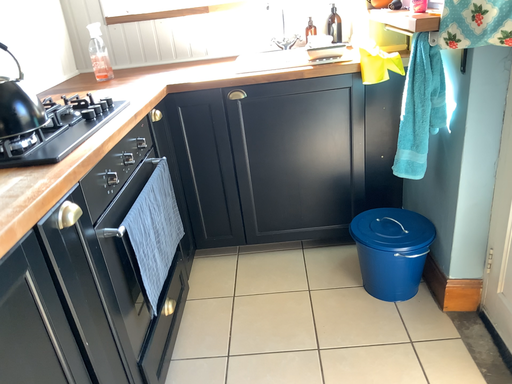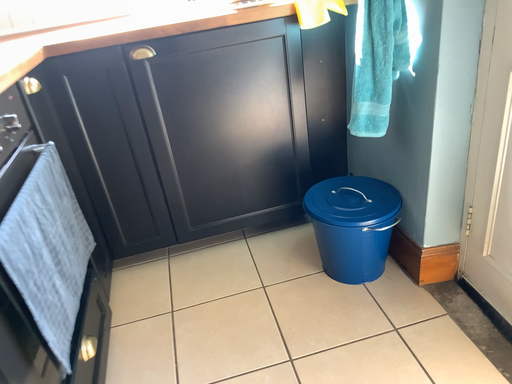
Question: How did the camera likely rotate when shooting the video?

Choices:
 (A) rotated left
 (B) rotated right

Answer: (B)